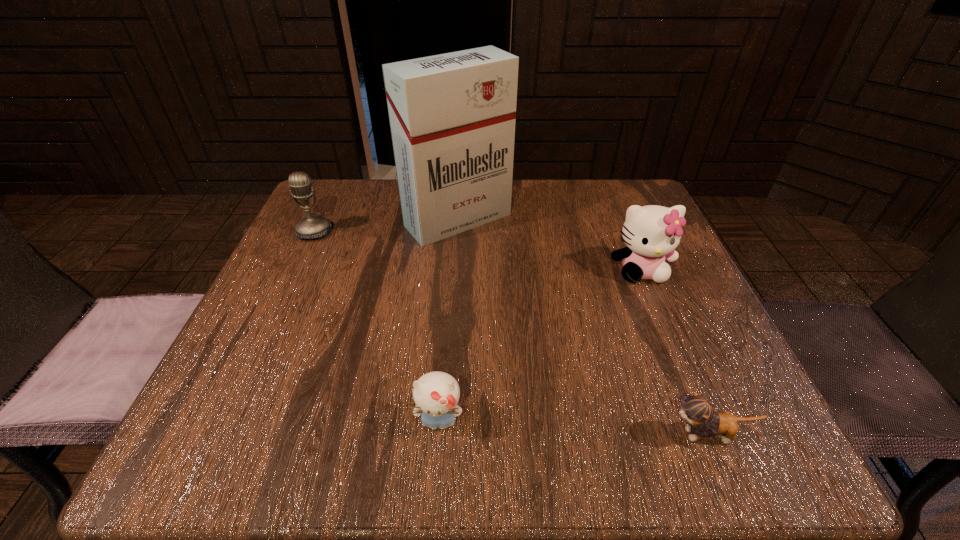
Where is `unoccupied area between the second shortest kitten and the shortest object`? This screenshot has height=540, width=960. unoccupied area between the second shortest kitten and the shortest object is located at coordinates pyautogui.click(x=574, y=428).

This screenshot has height=540, width=960. I want to click on free spot between the cigarette case and the shortest kitten, so click(584, 327).

Locate an element on the screen. Image resolution: width=960 pixels, height=540 pixels. empty space between the cigarette case and the farthest kitten is located at coordinates point(549,245).

Locate an element on the screen. vacant point located between the shortest object and the second shortest kitten is located at coordinates (574, 428).

Image resolution: width=960 pixels, height=540 pixels. Find the location of `empty space between the third farthest object and the shortest object`. empty space between the third farthest object and the shortest object is located at coordinates (675, 353).

Where is `object that stands as the fourth closest to the shortest object`? The width and height of the screenshot is (960, 540). object that stands as the fourth closest to the shortest object is located at coordinates point(312,226).

Image resolution: width=960 pixels, height=540 pixels. In order to click on the closest object to the microphone in this screenshot , I will do `click(452, 116)`.

Locate which kitten is the third closest to the cigarette case. Please provide its 2D coordinates. Your answer should be formatted as a tuple, i.e. [(x, y)], where the tuple contains the x and y coordinates of a point satisfying the conditions above.

[(699, 411)]

The height and width of the screenshot is (540, 960). I want to click on kitten that is the second closest to the second shortest object, so click(x=652, y=233).